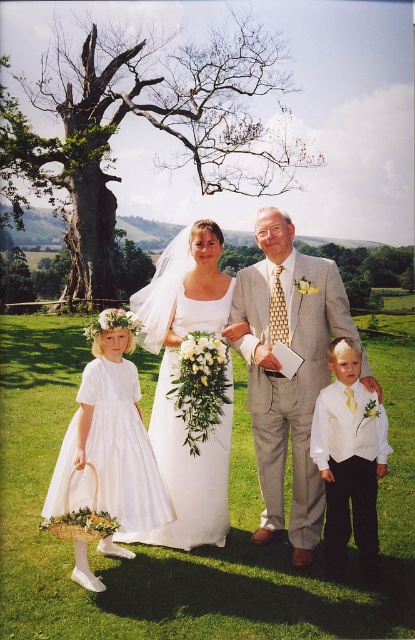
You are standing at the viewing point of this wedding scene. The photographer wants to capture a closeup shot of the white satin dress at center. Given that the camera can focus clearly on objects between 15 to 20 feet away, will the dress be in focus?

The white satin dress at center is 23.85 feet away from the viewer, which is beyond the camera focus range of 15 to 20 feet. Therefore, the dress will not be in focus.

You are a photographer positioned at the front of the wedding scene. You need to adjust your camera focus to capture both the white satin dress at lower left and the white satin wedding dress at center. Which dress should you focus on first to ensure both are in clear view?

The white satin dress at lower left is closer to the viewer than the white satin wedding dress at center. To ensure both are in clear view, focus on the closer dress first, then adjust for the one further away.

You are a photographer trying to capture a closeup of the light gray textured suit at center and the white satin vest at lower right. Which one is closer to the camera?

The light gray textured suit at center is closer to the camera because the white satin vest at lower right is behind it.